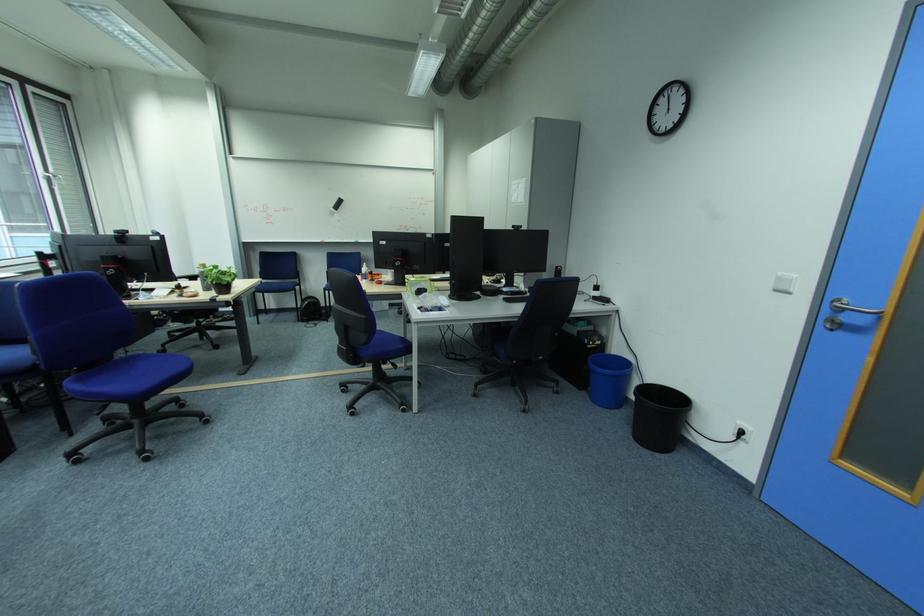
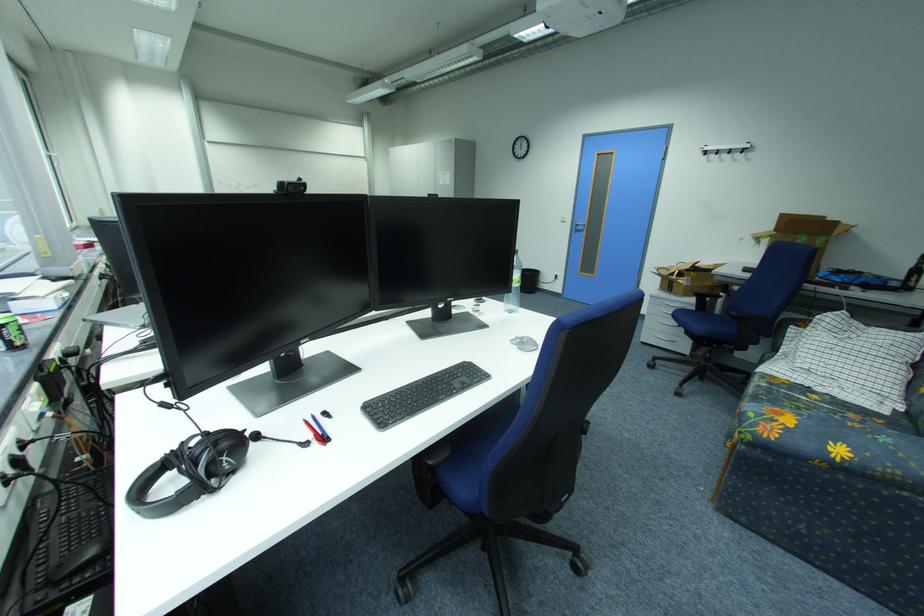
Find the pixel in the second image that matches (x=798, y=294) in the first image.

(574, 223)